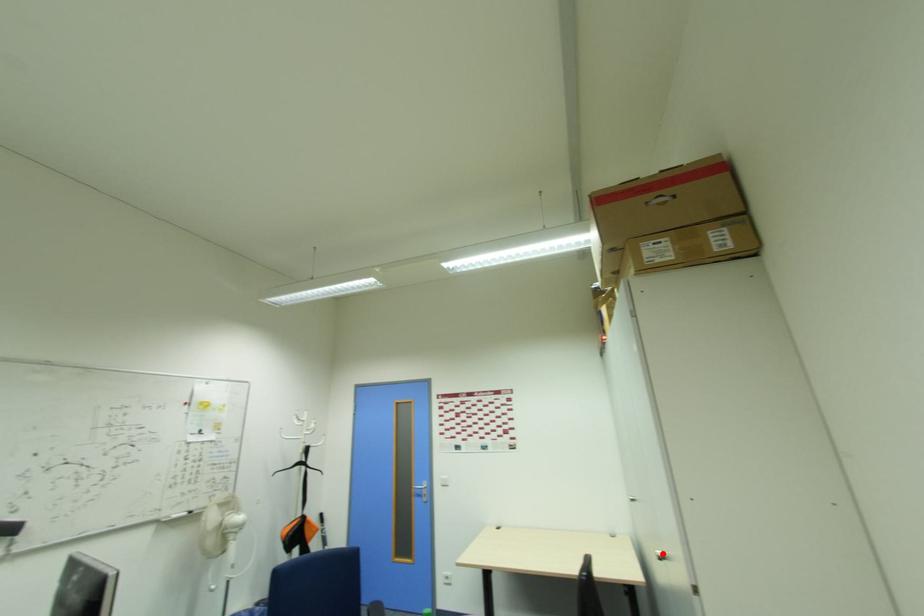
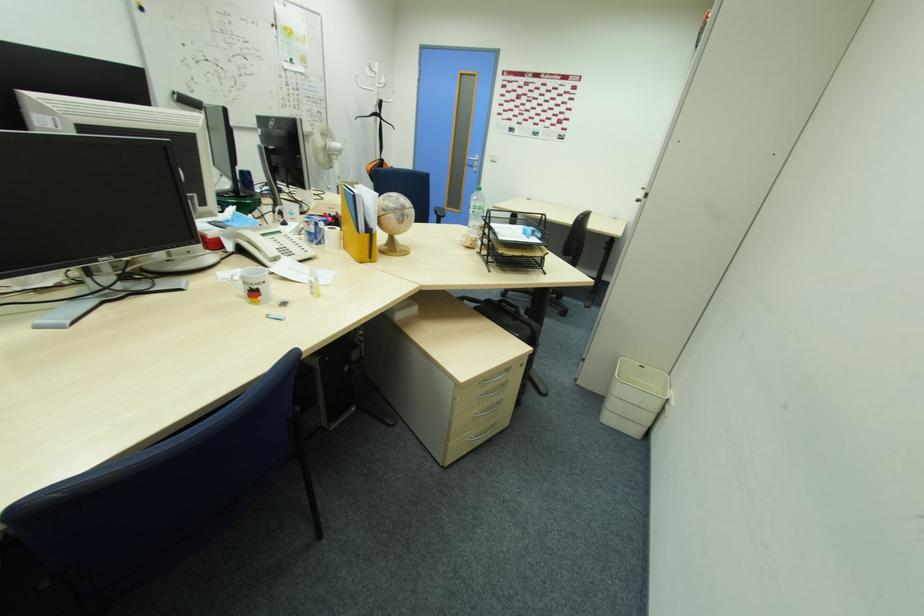
Question: I am providing you with two images of the same scene from different viewpoints. A red point is marked on the first image. At the location where the point appears in image 1, is it still visible in image 2?

Choices:
 (A) Yes
 (B) No

Answer: (B)